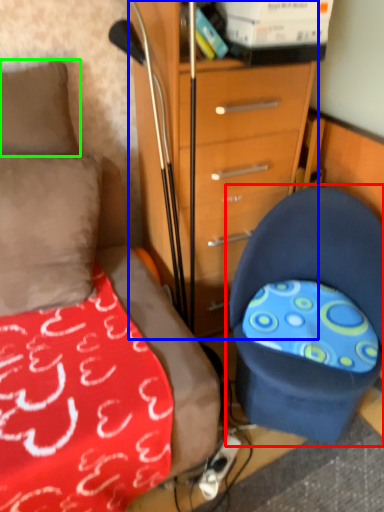
Question: Which is nearer to the chair (highlighted by a red box)? chest of drawers (highlighted by a blue box) or pillow (highlighted by a green box).

Choices:
 (A) chest of drawers
 (B) pillow

Answer: (A)